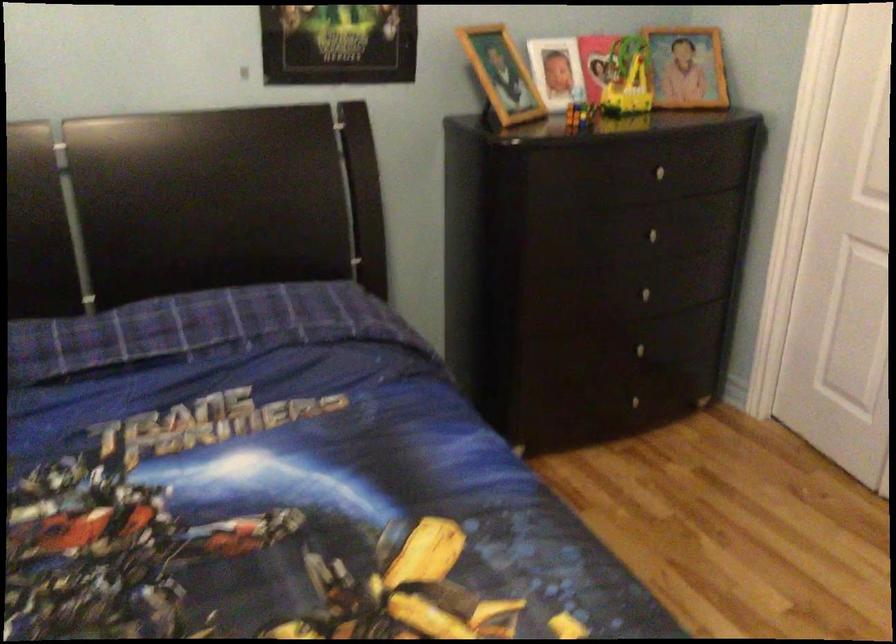
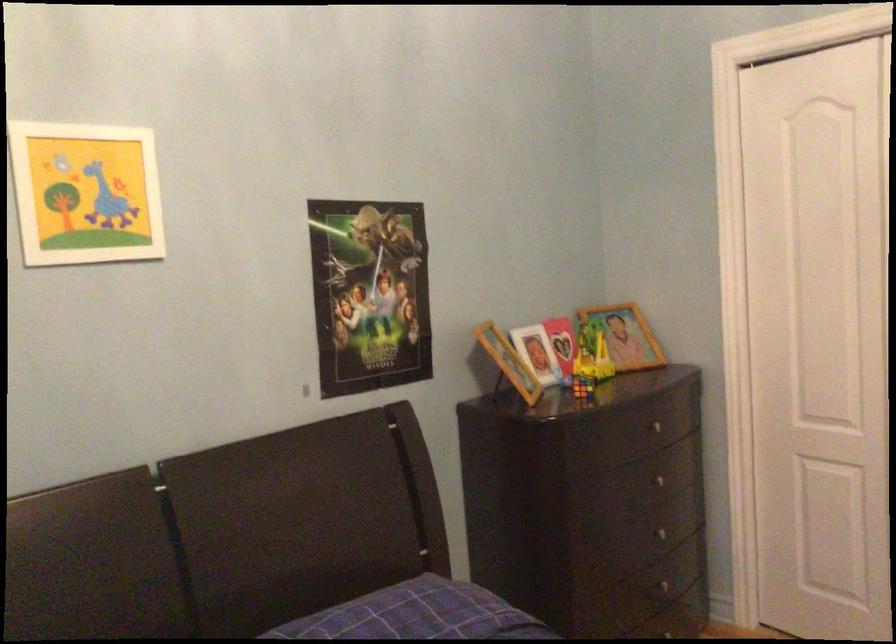
Locate, in the second image, the point that corresponds to (576,111) in the first image.

(582, 386)